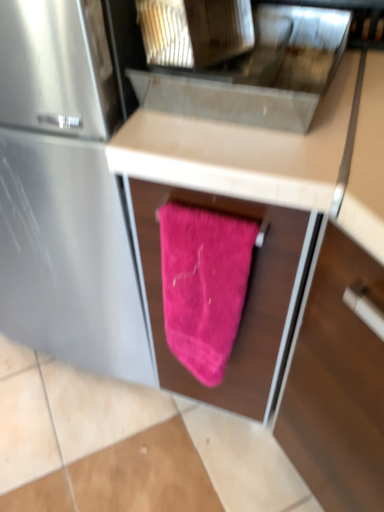
Question: In which direction should I rotate to look at metallic stainless steel sink at upper center?

Choices:
 (A) left
 (B) right

Answer: (B)

Question: Is metallic stainless steel sink at upper center at the right side of pink fuzzy towel at center?

Choices:
 (A) no
 (B) yes

Answer: (B)

Question: Considering the relative positions of metallic stainless steel sink at upper center and pink fuzzy towel at center in the image provided, is metallic stainless steel sink at upper center behind pink fuzzy towel at center?

Choices:
 (A) no
 (B) yes

Answer: (A)

Question: Is pink fuzzy towel at center located within metallic stainless steel sink at upper center?

Choices:
 (A) no
 (B) yes

Answer: (A)

Question: Does metallic stainless steel sink at upper center have a lesser height compared to pink fuzzy towel at center?

Choices:
 (A) no
 (B) yes

Answer: (B)

Question: Is metallic stainless steel sink at upper center oriented away from pink fuzzy towel at center?

Choices:
 (A) yes
 (B) no

Answer: (B)

Question: From a real-world perspective, is metallic stainless steel sink at upper center beneath pink fuzzy towel at center?

Choices:
 (A) no
 (B) yes

Answer: (A)

Question: Does pink fabric at center have a greater width compared to pink fuzzy towel at center?

Choices:
 (A) no
 (B) yes

Answer: (B)

Question: From a real-world perspective, is pink fabric at center on top of pink fuzzy towel at center?

Choices:
 (A) no
 (B) yes

Answer: (A)

Question: Would you say pink fabric at center is outside pink fuzzy towel at center?

Choices:
 (A) yes
 (B) no

Answer: (A)

Question: Would you say pink fabric at center is a long distance from pink fuzzy towel at center?

Choices:
 (A) no
 (B) yes

Answer: (A)

Question: Considering the relative positions of pink fabric at center and pink fuzzy towel at center in the image provided, is pink fabric at center behind pink fuzzy towel at center?

Choices:
 (A) yes
 (B) no

Answer: (B)

Question: Is pink fabric at center beside pink fuzzy towel at center?

Choices:
 (A) yes
 (B) no

Answer: (B)

Question: From the image's perspective, is metallic stainless steel sink at upper center located above pink fabric at center?

Choices:
 (A) no
 (B) yes

Answer: (B)